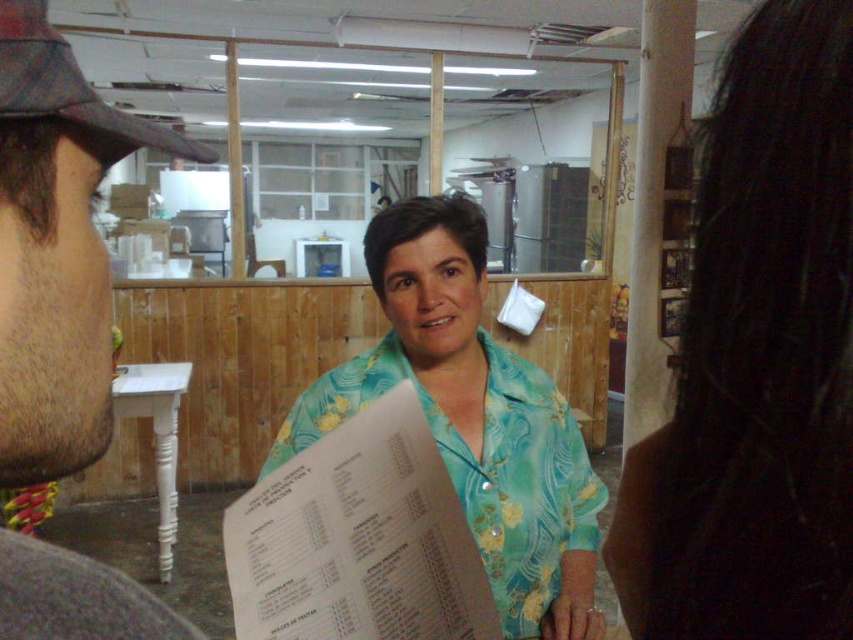
You are a customer sitting at the table in the background and want to reach both the point at (616, 529) and the point at (519, 628). Which point should you reach for first if you want to grab the closer one?

You should reach for point (519, 628) first because it is closer to you than point (616, 529).

You are a customer at a casual dining establishment and see the brown fuzzy hat at left and the turquoise floral shirt at center. Which object is narrower in width?

The brown fuzzy hat at left is thinner than the turquoise floral shirt at center, so the brown fuzzy hat at left is narrower in width.